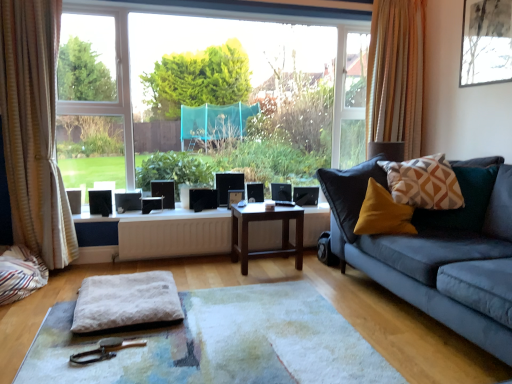
Question: Should I look upward or downward to see matte black picture frame at center, which ranks as the first picture frame in left-to-right order?

Choices:
 (A) down
 (B) up

Answer: (A)

Question: Can you confirm if matte black picture frame at upper right, positioned as the first picture frame in front-to-back order, is smaller than white matte radiator at center?

Choices:
 (A) no
 (B) yes

Answer: (A)

Question: From the image's perspective, is matte black picture frame at upper right, which is the 2th picture frame in bottom-to-top order, located beneath white matte radiator at center?

Choices:
 (A) yes
 (B) no

Answer: (B)

Question: Is matte black picture frame at upper right, acting as the 2th picture frame starting from the back, located outside white matte radiator at center?

Choices:
 (A) no
 (B) yes

Answer: (B)

Question: Is matte black picture frame at upper right, which ranks as the first picture frame in top-to-bottom order, oriented away from white matte radiator at center?

Choices:
 (A) no
 (B) yes

Answer: (A)

Question: Considering the relative positions of matte black picture frame at upper right, which is the 2th picture frame in bottom-to-top order, and white matte radiator at center in the image provided, is matte black picture frame at upper right, which is the 2th picture frame in bottom-to-top order, to the right of white matte radiator at center from the viewer's perspective?

Choices:
 (A) yes
 (B) no

Answer: (A)

Question: Does matte black picture frame at upper right, positioned as the first picture frame in front-to-back order, turn towards white matte radiator at center?

Choices:
 (A) no
 (B) yes

Answer: (A)

Question: Is white soft cushion at center surrounding white fluffy footrest at center?

Choices:
 (A) yes
 (B) no

Answer: (B)

Question: Does white soft cushion at center appear on the right side of white fluffy footrest at center?

Choices:
 (A) yes
 (B) no

Answer: (A)

Question: Does white soft cushion at center appear on the left side of white fluffy footrest at center?

Choices:
 (A) yes
 (B) no

Answer: (B)

Question: Is white soft cushion at center further to camera compared to white fluffy footrest at center?

Choices:
 (A) no
 (B) yes

Answer: (A)

Question: Can you confirm if white soft cushion at center is shorter than white fluffy footrest at center?

Choices:
 (A) no
 (B) yes

Answer: (B)

Question: From the image's perspective, is white soft cushion at center beneath white fluffy footrest at center?

Choices:
 (A) no
 (B) yes

Answer: (B)

Question: Can you confirm if beige textured curtain at right, which is the second curtain in left-to-right order, is shorter than white soft cushion at center?

Choices:
 (A) no
 (B) yes

Answer: (A)